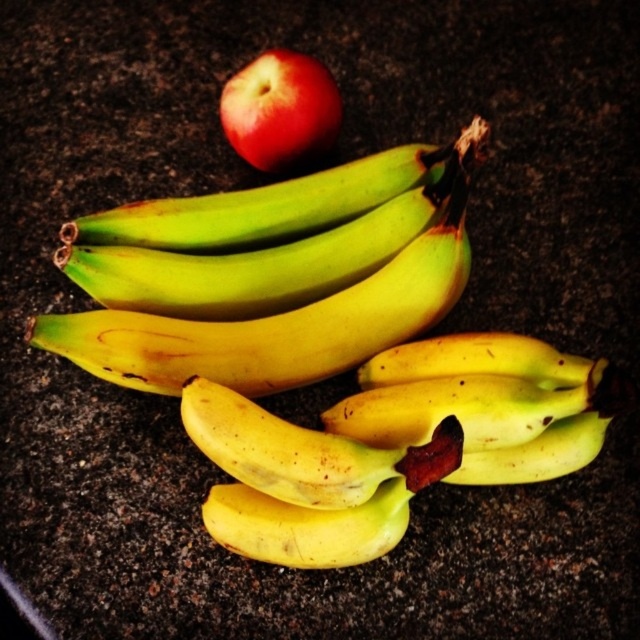
Question: In this image, where is yellow matte banana at center located relative to glossy red apple at upper center?

Choices:
 (A) below
 (B) above

Answer: (A)

Question: Which of the following is the farthest from the observer?

Choices:
 (A) yellow matte banana at center
 (B) glossy red apple at upper center

Answer: (B)

Question: Is the position of yellow matte banana at center more distant than that of glossy red apple at upper center?

Choices:
 (A) yes
 (B) no

Answer: (B)

Question: Estimate the real-world distances between objects in this image. Which object is farther from the yellow matte bananas at center?

Choices:
 (A) yellow matte banana at center
 (B) glossy red apple at upper center

Answer: (B)

Question: Which of the following is the closest to the observer?

Choices:
 (A) (317, 76)
 (B) (72, 332)
 (C) (400, 461)

Answer: (C)

Question: Does yellow matte bananas at center have a greater width compared to glossy red apple at upper center?

Choices:
 (A) yes
 (B) no

Answer: (A)